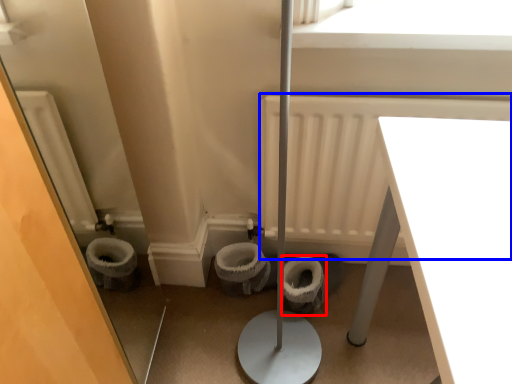
Question: Among these objects, which one is farthest to the camera, toilet bowl (highlighted by a red box) or radiator (highlighted by a blue box)?

Choices:
 (A) toilet bowl
 (B) radiator

Answer: (A)